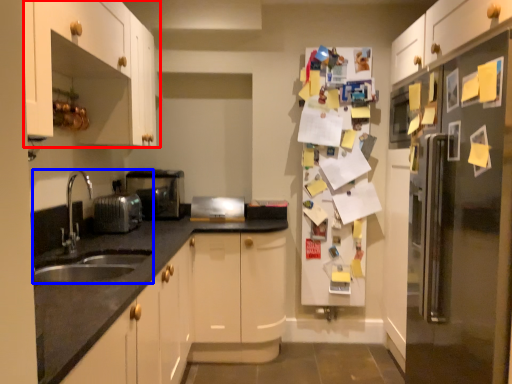
Question: Which object appears farthest to the camera in this image, cabinetry (highlighted by a red box) or sink (highlighted by a blue box)?

Choices:
 (A) cabinetry
 (B) sink

Answer: (B)